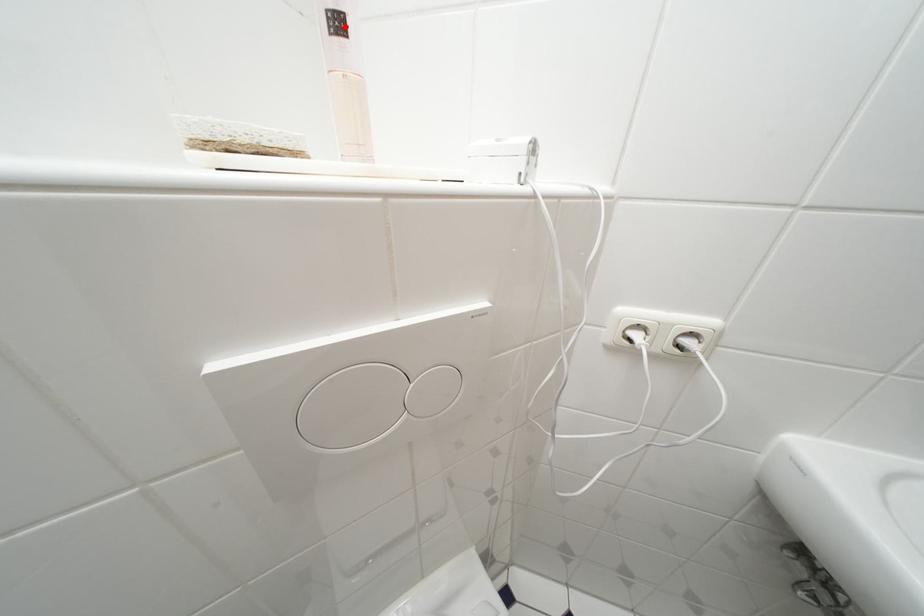
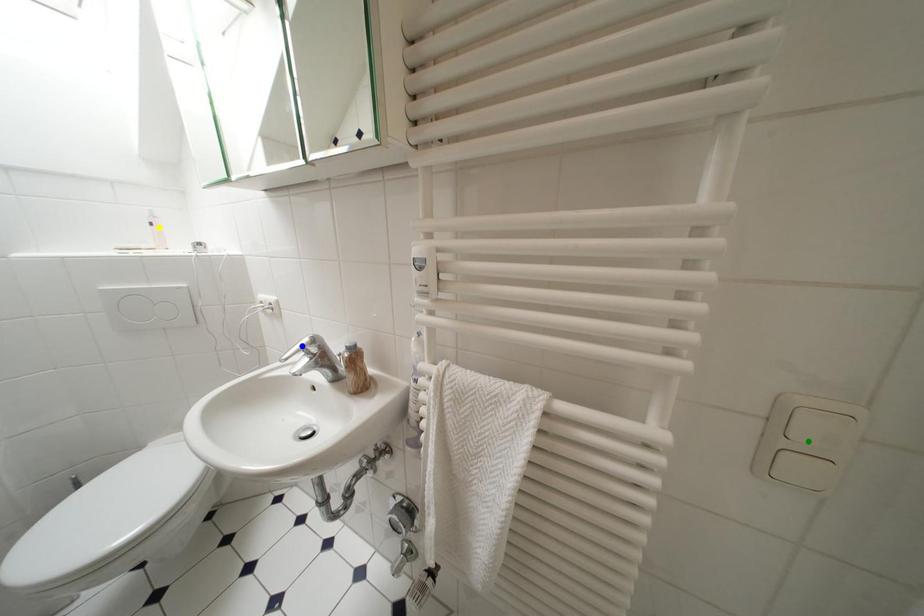
Question: I am providing you with two images of the same scene from different viewpoints. A red point is marked on the first image. You are given multiple points on the second image. Which mark in image 2 goes with the point in image 1?

Choices:
 (A) blue point
 (B) green point
 (C) yellow point

Answer: (C)